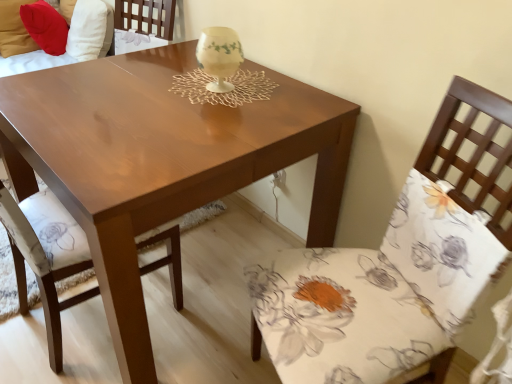
Locate an element on the screen. matte wood chair at center, which is the 2th chair from right to left is located at coordinates (46, 256).

Where is `shiny brown table at center`? This screenshot has width=512, height=384. shiny brown table at center is located at coordinates (160, 161).

You are a GUI agent. You are given a task and a screenshot of the screen. Output one action in this format:
    pyautogui.click(x=<x>, y=<y>)
    Task: Click on the ivory porcelain candle holder at center
    This screenshot has width=512, height=384.
    Given the screenshot: What is the action you would take?
    pyautogui.click(x=219, y=56)

This screenshot has width=512, height=384. What do you see at coordinates (70, 41) in the screenshot?
I see `velvet red pillow at upper left, positioned as the 1th couch in right-to-left order` at bounding box center [70, 41].

Locate an element on the screen. This screenshot has width=512, height=384. matte wood chair at center, which is the 2th chair from right to left is located at coordinates (46, 256).

Does floral fabric chair at right, the 1th chair from the right, have a greater width compared to ivory porcelain candle holder at center?

Yes.

Image resolution: width=512 pixels, height=384 pixels. What are the coordinates of `candle holder located on the left of floral fabric chair at right, the 1th chair from the right` in the screenshot? It's located at (219, 56).

From the image's perspective, is floral fabric chair at right, which is the second chair in left-to-right order, positioned above or below ivory porcelain candle holder at center?

Clearly, from the image's perspective, floral fabric chair at right, which is the second chair in left-to-right order, is below ivory porcelain candle holder at center.

Is velvet red pillow at upper left, positioned as the 1th couch in right-to-left order, completely or partially inside ivory porcelain candle holder at center?

No, velvet red pillow at upper left, positioned as the 1th couch in right-to-left order, is not inside ivory porcelain candle holder at center.

Which object is positioned more to the right, ivory porcelain candle holder at center or velvet red pillow at upper left, positioned as the 1th couch in right-to-left order?

ivory porcelain candle holder at center is more to the right.

From the image's perspective, between ivory porcelain candle holder at center and velvet red pillow at upper left, positioned as the 1th couch in right-to-left order, which one is located above?

velvet red pillow at upper left, positioned as the 1th couch in right-to-left order, from the image's perspective.

From a real-world perspective, relative to velvet red pillow at upper left, marked as the second couch in a left-to-right arrangement, is ivory porcelain candle holder at center vertically above or below?

Clearly, from a real-world perspective, ivory porcelain candle holder at center is above velvet red pillow at upper left, marked as the second couch in a left-to-right arrangement.

From the image's perspective, would you say floral fabric chair at right, which is the second chair in left-to-right order, is positioned over matte wood chair at center, which is the 1th chair from left to right?

No, from the image's perspective, floral fabric chair at right, which is the second chair in left-to-right order, is not over matte wood chair at center, which is the 1th chair from left to right.

How many degrees apart are the facing directions of floral fabric chair at right, which is the second chair in left-to-right order, and matte wood chair at center, which is the 1th chair from left to right?

158 degrees separate the facing orientations of floral fabric chair at right, which is the second chair in left-to-right order, and matte wood chair at center, which is the 1th chair from left to right.

From the picture: Is matte wood chair at center, which is the 2th chair from right to left, at the back of floral fabric chair at right, which is the second chair in left-to-right order?

floral fabric chair at right, which is the second chair in left-to-right order, is not turned away from matte wood chair at center, which is the 2th chair from right to left.

Can matte wood chair at center, which is the 1th chair from left to right, be found inside floral fabric chair at right, which is the second chair in left-to-right order?

No, matte wood chair at center, which is the 1th chair from left to right, is located outside of floral fabric chair at right, which is the second chair in left-to-right order.

Locate an element on the screen. This screenshot has width=512, height=384. couch that is the 1st object located behind the ivory porcelain candle holder at center is located at coordinates (71, 41).

Which is in front, matte brown couch at upper left, which appears as the 2th couch when viewed from the right, or ivory porcelain candle holder at center?

Positioned in front is ivory porcelain candle holder at center.

Measure the distance between matte brown couch at upper left, positioned as the 1th couch in left-to-right order, and ivory porcelain candle holder at center.

They are 1.22 meters apart.

Based on the photo, could you tell me if matte brown couch at upper left, positioned as the 1th couch in left-to-right order, is turned towards ivory porcelain candle holder at center?

Yes, matte brown couch at upper left, positioned as the 1th couch in left-to-right order, is turned towards ivory porcelain candle holder at center.

Are ivory porcelain candle holder at center and shiny brown table at center far apart?

They are positioned close to each other.

Does ivory porcelain candle holder at center have a greater width compared to shiny brown table at center?

In fact, ivory porcelain candle holder at center might be narrower than shiny brown table at center.

Is ivory porcelain candle holder at center at the left side of shiny brown table at center?

No.

In the scene shown: Is ivory porcelain candle holder at center oriented away from shiny brown table at center?

No, shiny brown table at center is not at the back of ivory porcelain candle holder at center.

Consider the image. Between shiny brown table at center and velvet red pillow at upper left, positioned as the 1th couch in right-to-left order, which one appears on the left side from the viewer's perspective?

Positioned to the left is velvet red pillow at upper left, positioned as the 1th couch in right-to-left order.

Where is `coffee table that is in front of the velvet red pillow at upper left, marked as the second couch in a left-to-right arrangement`? The image size is (512, 384). coffee table that is in front of the velvet red pillow at upper left, marked as the second couch in a left-to-right arrangement is located at coordinates (160, 161).

Who is bigger, shiny brown table at center or velvet red pillow at upper left, positioned as the 1th couch in right-to-left order?

shiny brown table at center.

Which point is more distant from viewer, (353, 130) or (103, 26)?

Point (103, 26)

Looking at this image, between shiny brown table at center and floral fabric chair at right, the 1th chair from the right, which one has larger size?

Bigger between the two is shiny brown table at center.

Between point (110, 99) and point (361, 296), which one is positioned behind?

The point (110, 99) is more distant.

Between shiny brown table at center and floral fabric chair at right, the 1th chair from the right, which one is positioned behind?

shiny brown table at center is further from the camera.

Which of these two, shiny brown table at center or floral fabric chair at right, the 1th chair from the right, stands shorter?

With less height is shiny brown table at center.

Find the location of a particular element. The image size is (512, 384). candle holder positioned vertically above the floral fabric chair at right, the 1th chair from the right (from a real-world perspective) is located at coordinates (219, 56).

From a real-world perspective, count 1st couchs downward from the ivory porcelain candle holder at center and point to it. Please provide its 2D coordinates.

[(70, 41)]

From the image, which object appears to be nearer to velvet red pillow at upper left, positioned as the 1th couch in right-to-left order, floral fabric chair at right, the 1th chair from the right, or matte brown couch at upper left, positioned as the 1th couch in left-to-right order?

matte brown couch at upper left, positioned as the 1th couch in left-to-right order, lies closer to velvet red pillow at upper left, positioned as the 1th couch in right-to-left order, than the other object.

From the image, which object appears to be farther from matte wood chair at center, which is the 1th chair from left to right, matte brown couch at upper left, which appears as the 2th couch when viewed from the right, or floral fabric chair at right, which is the second chair in left-to-right order?

matte brown couch at upper left, which appears as the 2th couch when viewed from the right, is further to matte wood chair at center, which is the 1th chair from left to right.

Looking at this image, based on their spatial positions, is ivory porcelain candle holder at center or shiny brown table at center closer to floral fabric chair at right, the 1th chair from the right?

shiny brown table at center is closer to floral fabric chair at right, the 1th chair from the right.

Consider the image. Which object lies nearer to the anchor point matte wood chair at center, which is the 1th chair from left to right, velvet red pillow at upper left, marked as the second couch in a left-to-right arrangement, or floral fabric chair at right, the 1th chair from the right?

Among the two, floral fabric chair at right, the 1th chair from the right, is located nearer to matte wood chair at center, which is the 1th chair from left to right.

Estimate the real-world distances between objects in this image. Which object is closer to matte brown couch at upper left, positioned as the 1th couch in left-to-right order, floral fabric chair at right, the 1th chair from the right, or ivory porcelain candle holder at center?

ivory porcelain candle holder at center lies closer to matte brown couch at upper left, positioned as the 1th couch in left-to-right order, than the other object.

Estimate the real-world distances between objects in this image. Which object is further from matte brown couch at upper left, which appears as the 2th couch when viewed from the right, floral fabric chair at right, which is the second chair in left-to-right order, or matte wood chair at center, which is the 2th chair from right to left?

Among the two, floral fabric chair at right, which is the second chair in left-to-right order, is located further to matte brown couch at upper left, which appears as the 2th couch when viewed from the right.

From the image, which object appears to be farther from ivory porcelain candle holder at center, shiny brown table at center or matte brown couch at upper left, which appears as the 2th couch when viewed from the right?

The object further to ivory porcelain candle holder at center is matte brown couch at upper left, which appears as the 2th couch when viewed from the right.

From the image, which object appears to be farther from ivory porcelain candle holder at center, shiny brown table at center or matte wood chair at center, which is the 2th chair from right to left?

matte wood chair at center, which is the 2th chair from right to left, is positioned further to the anchor ivory porcelain candle holder at center.

Identify the location of coffee table positioned between floral fabric chair at right, which is the second chair in left-to-right order, and ivory porcelain candle holder at center from near to far. (160, 161).

Find the location of a particular element. The image size is (512, 384). candle holder between matte brown couch at upper left, which appears as the 2th couch when viewed from the right, and floral fabric chair at right, which is the second chair in left-to-right order is located at coordinates (219, 56).

You are a GUI agent. You are given a task and a screenshot of the screen. Output one action in this format:
    pyautogui.click(x=<x>, y=<y>)
    Task: Click on the coffee table between matte wood chair at center, which is the 1th chair from left to right, and matte brown couch at upper left, positioned as the 1th couch in left-to-right order, in the front-back direction
    
    Given the screenshot: What is the action you would take?
    pyautogui.click(x=160, y=161)

You are a GUI agent. You are given a task and a screenshot of the screen. Output one action in this format:
    pyautogui.click(x=<x>, y=<y>)
    Task: Click on the chair between floral fabric chair at right, the 1th chair from the right, and velvet red pillow at upper left, marked as the second couch in a left-to-right arrangement, in the front-back direction
    
    Given the screenshot: What is the action you would take?
    pyautogui.click(x=46, y=256)